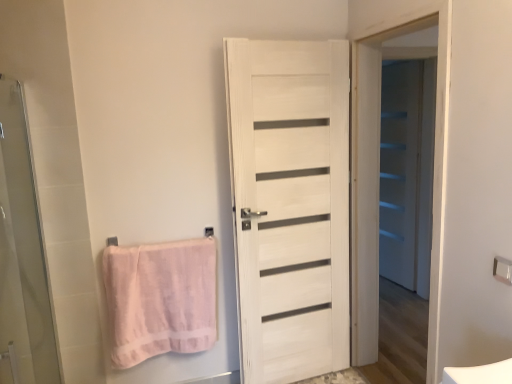
Question: From a real-world perspective, is white wooden door at center, the second screen door when ordered from left to right, above or below metallic silver towel bar at upper right, acting as the first towel bar starting from the right?

Choices:
 (A) below
 (B) above

Answer: (A)

Question: From the image's perspective, is white wooden door at center, marked as the second screen door in a front-to-back arrangement, above or below metallic silver towel bar at upper right, acting as the first towel bar starting from the right?

Choices:
 (A) below
 (B) above

Answer: (B)

Question: Considering the real-world distances, which object is farthest from the white wooden door at center, the second screen door when ordered from left to right?

Choices:
 (A) white matte screen door at right, positioned as the third screen door in left-to-right order
 (B) metallic silver towel bar at upper right, which is the second towel bar in left-to-right order
 (C) transparent glass screen door at left, the 3th screen door in the right-to-left sequence
 (D) pink cotton towel at left
 (E) white wood door at center

Answer: (C)

Question: Estimate the real-world distances between objects in this image. Which object is closer to the white wood door at center?

Choices:
 (A) white matte screen door at right, which appears as the third screen door when viewed from the front
 (B) white wooden door at center, the second screen door when ordered from left to right
 (C) pink fabric towel bar at lower left, arranged as the 2th towel bar when viewed from the front
 (D) transparent glass screen door at left, arranged as the 3th screen door when viewed from the back
 (E) pink cotton towel at left

Answer: (B)